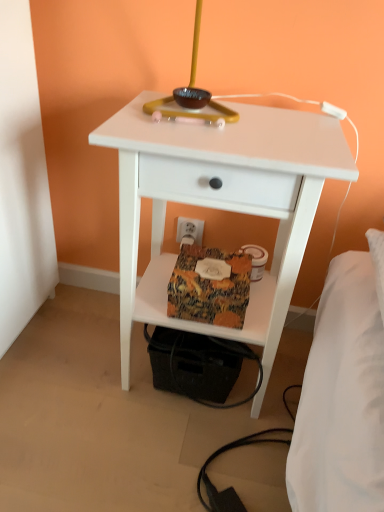
Question: Is white plastic electric outlet at lower center in front of or behind matte yellow table lamp at upper center in the image?

Choices:
 (A) behind
 (B) front

Answer: (A)

Question: Would you say white plastic electric outlet at lower center is inside or outside matte yellow table lamp at upper center?

Choices:
 (A) outside
 (B) inside

Answer: (A)

Question: Which of these objects is positioned farthest from the textured fabric package at lower center?

Choices:
 (A) white matte nightstand at center
 (B) white plastic electric outlet at lower center
 (C) matte yellow table lamp at upper center

Answer: (C)

Question: Estimate the real-world distances between objects in this image. Which object is closer to the white matte nightstand at center?

Choices:
 (A) textured fabric package at lower center
 (B) white plastic electric outlet at lower center
 (C) matte yellow table lamp at upper center

Answer: (A)